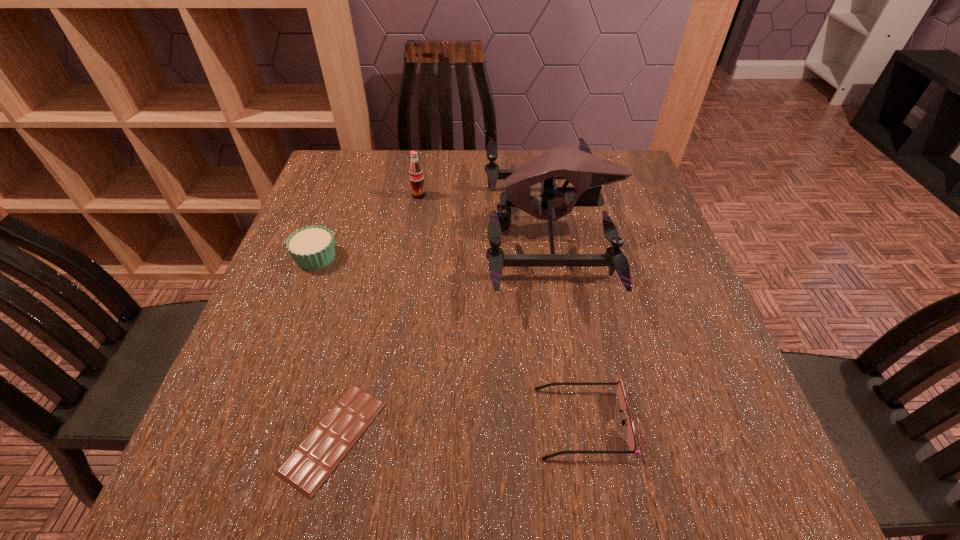
Identify the location of vacant space located on the front of the third tallest object. This screenshot has height=540, width=960. (288, 332).

Where is `blank space located 0.390m on the bridge of the sunglasses`? The width and height of the screenshot is (960, 540). blank space located 0.390m on the bridge of the sunglasses is located at coordinates (301, 422).

At what (x,y) coordinates should I click in order to perform the action: click on free region located 0.180m on the bridge of the sunglasses. Please return your answer as a coordinate pair (x, y). Looking at the image, I should click on (429, 422).

At what (x,y) coordinates should I click in order to perform the action: click on free space located on the bridge of the sunglasses. Please return your answer as a coordinate pair (x, y). The image size is (960, 540). Looking at the image, I should click on (320, 422).

Identify the location of vacant space located on the left of the chocolate bar. (218, 436).

Where is `drone present at the far edge`? This screenshot has width=960, height=540. drone present at the far edge is located at coordinates (586, 172).

The image size is (960, 540). What are the coordinates of `soda that is positioned at the far edge` in the screenshot? It's located at (416, 175).

This screenshot has height=540, width=960. What are the coordinates of `sunglasses that is positioned at the near edge` in the screenshot? It's located at (631, 441).

At what (x,y) coordinates should I click in order to perform the action: click on chocolate bar that is at the near edge. Please return your answer as a coordinate pair (x, y). This screenshot has height=540, width=960. Looking at the image, I should click on (310, 464).

I want to click on cupcake located in the left edge section of the desktop, so click(x=312, y=247).